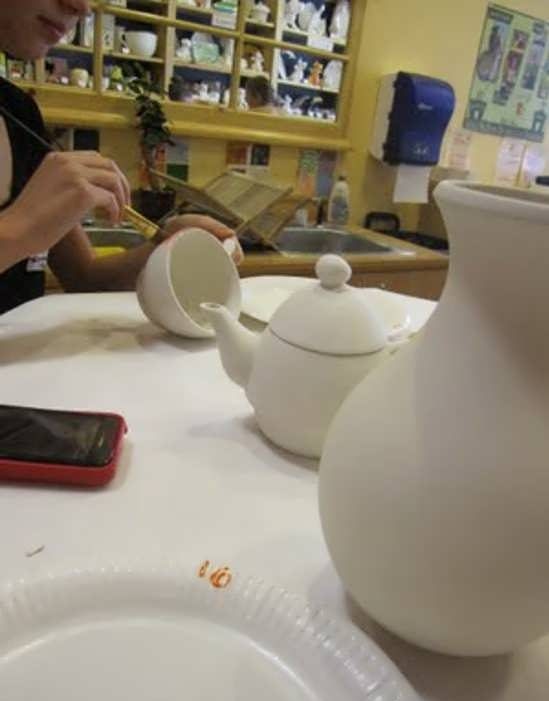
Where is `pottery`? The image size is (549, 701). pottery is located at coordinates (192, 264), (272, 334), (503, 455).